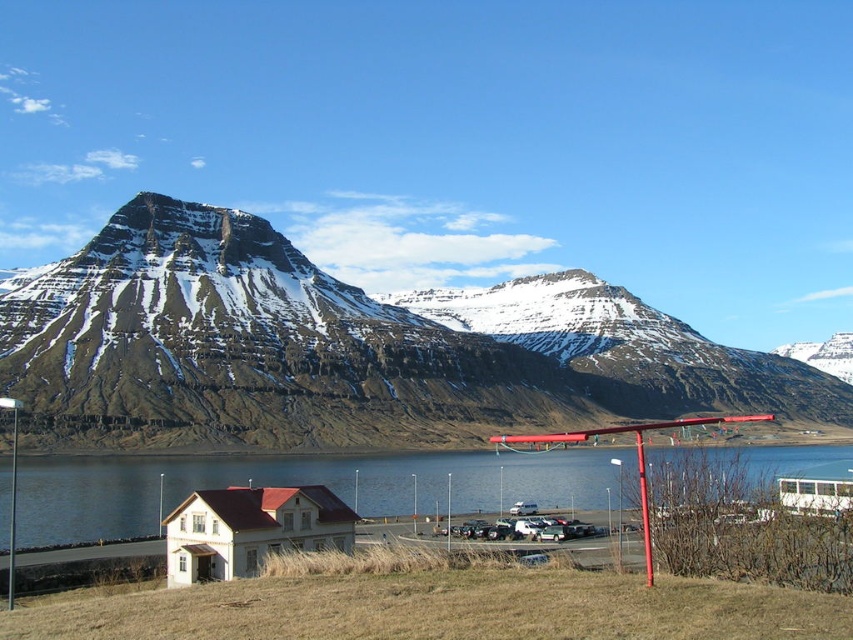
You are planning to take a photo of the snowy rock mountain at upper center and the blue water at lower center. Which object will occupy more horizontal space in your photo?

The snowy rock mountain at upper center will occupy more horizontal space in the photo because its width surpasses that of the blue water at lower center.